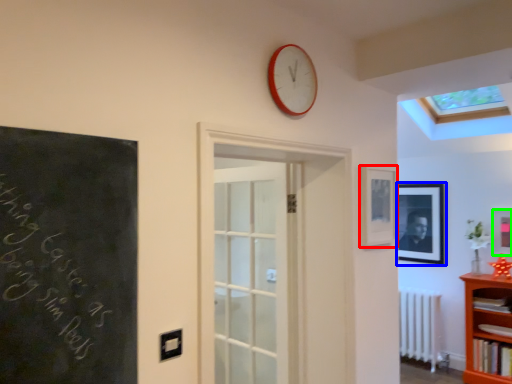
Question: Which is farther away from picture frame (highlighted by a red box)? picture frame (highlighted by a blue box) or picture frame (highlighted by a green box)?

Choices:
 (A) picture frame
 (B) picture frame

Answer: (A)